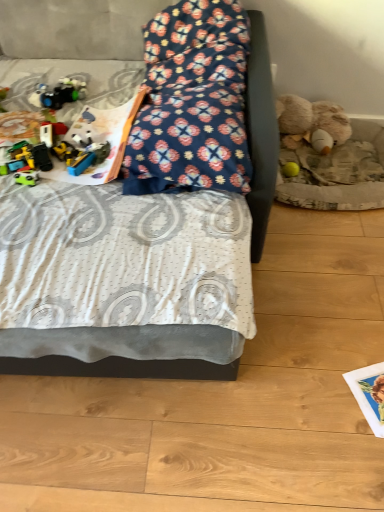
Question: Is yellow rubber ball at lower right, the second toy viewed from the top, wider or thinner than floral fabric bed at center?

Choices:
 (A) wide
 (B) thin

Answer: (B)

Question: From a real-world perspective, is yellow rubber ball at lower right, which is the second toy from bottom to top, above or below floral fabric bed at center?

Choices:
 (A) above
 (B) below

Answer: (B)

Question: Which object is the farthest from the floral fabric bed at center?

Choices:
 (A) matte green toy car at left, placed as the first toy when sorted from front to back
 (B) shiny plastic toy car at left, arranged as the 1th toy when viewed from the top
 (C) floral fabric pillow at center
 (D) yellow rubber ball at lower right, the first toy viewed from the right
 (E) fluffy beige teddy bear at right

Answer: (E)

Question: Which object is the farthest from the matte green toy car at left, the 2th toy when ordered from right to left?

Choices:
 (A) floral fabric pillow at center
 (B) fluffy beige teddy bear at right
 (C) yellow rubber ball at lower right, which is the first toy from back to front
 (D) floral fabric bed at center
 (E) shiny plastic toy car at left, the 2th toy in the front-to-back sequence

Answer: (B)